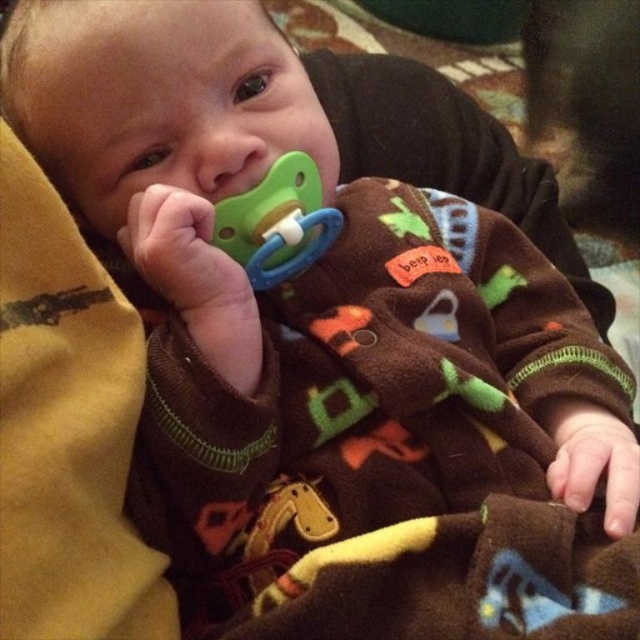
Does point (560, 509) come in front of point (260, 252)?

Yes, it is.

Between brown fleece blanket at lower center and green rubber pacifier at center, which one is positioned lower?

brown fleece blanket at lower center is below.

The image size is (640, 640). I want to click on brown fleece blanket at lower center, so click(x=458, y=580).